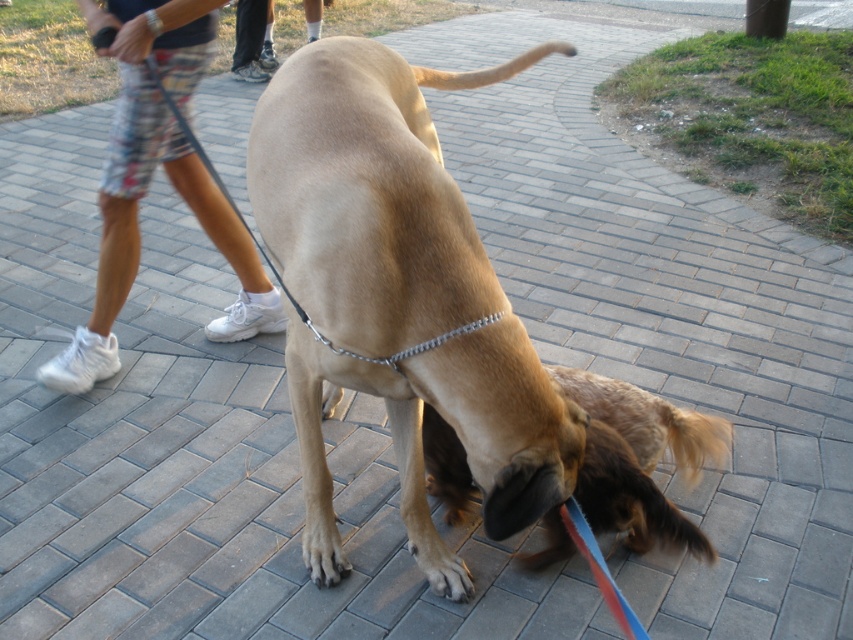
Between point (193, 72) and point (316, 586), which one is positioned in front?

Point (316, 586) is in front.

Who is lower down, white fabric shorts at left or brown fur paw at lower center?

brown fur paw at lower center is lower down.

Identify the location of white fabric shorts at left. This screenshot has height=640, width=853. (149, 180).

Can you confirm if brown matte paw at lower center is smaller than brown fur paw at lower center?

Indeed, brown matte paw at lower center has a smaller size compared to brown fur paw at lower center.

Does brown matte paw at lower center have a larger size compared to brown fur paw at lower center?

No, brown matte paw at lower center is not bigger than brown fur paw at lower center.

Does point (430, 563) lie behind point (306, 528)?

No, it is not.

I want to click on brown matte paw at lower center, so coord(440,566).

Which of these two, white fabric shorts at left or brown matte paw at lower center, stands shorter?

Standing shorter between the two is brown matte paw at lower center.

Is point (122, 179) behind point (453, 579)?

Yes, point (122, 179) is farther from viewer.

Is point (137, 253) positioned before point (438, 588)?

No, it is behind (438, 588).

Where is `white fabric shorts at left`? This screenshot has height=640, width=853. white fabric shorts at left is located at coordinates (149, 180).